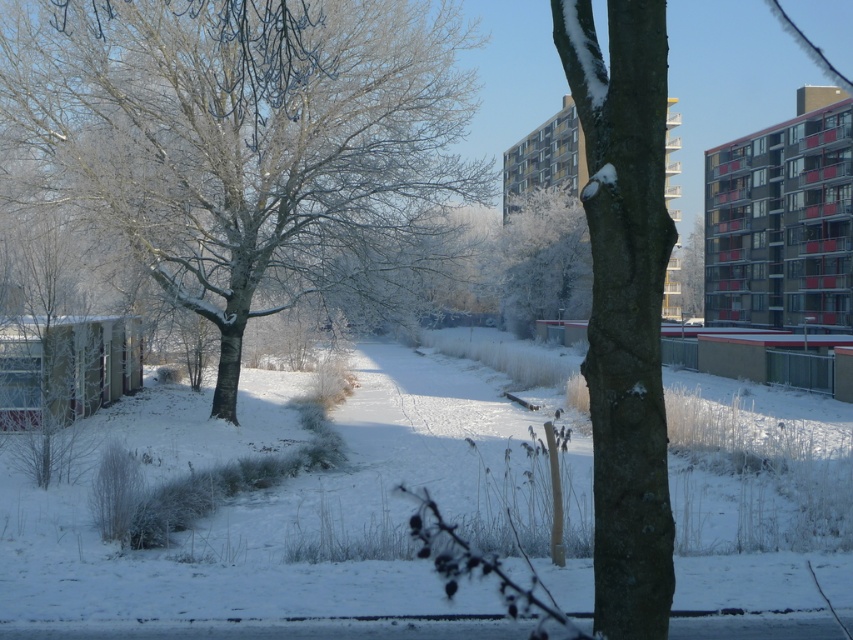
Question: Does frosted white tree at left have a greater width compared to frosted white tree at center?

Choices:
 (A) yes
 (B) no

Answer: (A)

Question: Is frosted white tree at left closer to camera compared to frosted white tree at center?

Choices:
 (A) yes
 (B) no

Answer: (A)

Question: Can you confirm if frosted white tree at left is thinner than snowy bark tree at center?

Choices:
 (A) yes
 (B) no

Answer: (B)

Question: Which of these objects is positioned closest to the frosted white tree at center?

Choices:
 (A) frosted white tree at left
 (B) snowy bark tree at center

Answer: (A)

Question: Among these objects, which one is nearest to the camera?

Choices:
 (A) snowy bark tree at center
 (B) frosted white tree at left

Answer: (A)

Question: Estimate the real-world distances between objects in this image. Which object is farther from the frosted white tree at left?

Choices:
 (A) frosted white tree at center
 (B) snowy bark tree at center

Answer: (A)